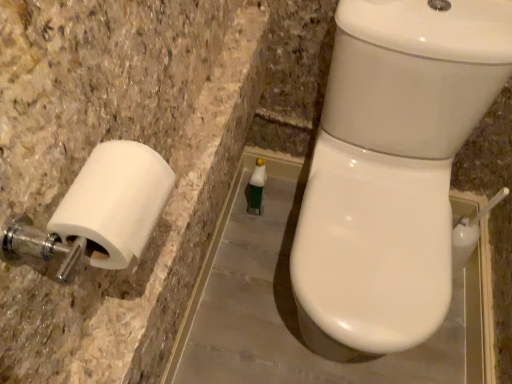
Question: Is white matte toilet paper at left outside of green matte bottle at center?

Choices:
 (A) no
 (B) yes

Answer: (B)

Question: Can green matte bottle at center be found inside white matte toilet paper at left?

Choices:
 (A) yes
 (B) no

Answer: (B)

Question: Considering the relative positions of white matte toilet paper at left and green matte bottle at center in the image provided, is white matte toilet paper at left to the left of green matte bottle at center from the viewer's perspective?

Choices:
 (A) no
 (B) yes

Answer: (B)

Question: Is white matte toilet paper at left next to green matte bottle at center?

Choices:
 (A) no
 (B) yes

Answer: (A)

Question: Does white matte toilet paper at left turn towards green matte bottle at center?

Choices:
 (A) no
 (B) yes

Answer: (A)

Question: Can you confirm if white matte toilet paper at left is shorter than green matte bottle at center?

Choices:
 (A) no
 (B) yes

Answer: (B)

Question: Is green matte bottle at center located within white glossy toilet at right?

Choices:
 (A) yes
 (B) no

Answer: (B)

Question: From a real-world perspective, is white glossy toilet at right located beneath green matte bottle at center?

Choices:
 (A) no
 (B) yes

Answer: (A)

Question: Is white glossy toilet at right to the right of green matte bottle at center from the viewer's perspective?

Choices:
 (A) no
 (B) yes

Answer: (B)

Question: Is white glossy toilet at right oriented towards green matte bottle at center?

Choices:
 (A) no
 (B) yes

Answer: (A)

Question: From the image's perspective, does white glossy toilet at right appear lower than green matte bottle at center?

Choices:
 (A) yes
 (B) no

Answer: (A)

Question: Considering the relative sizes of white glossy toilet at right and green matte bottle at center in the image provided, is white glossy toilet at right taller than green matte bottle at center?

Choices:
 (A) yes
 (B) no

Answer: (A)

Question: Can you confirm if green matte bottle at center is positioned to the left of white glossy toilet at right?

Choices:
 (A) yes
 (B) no

Answer: (A)